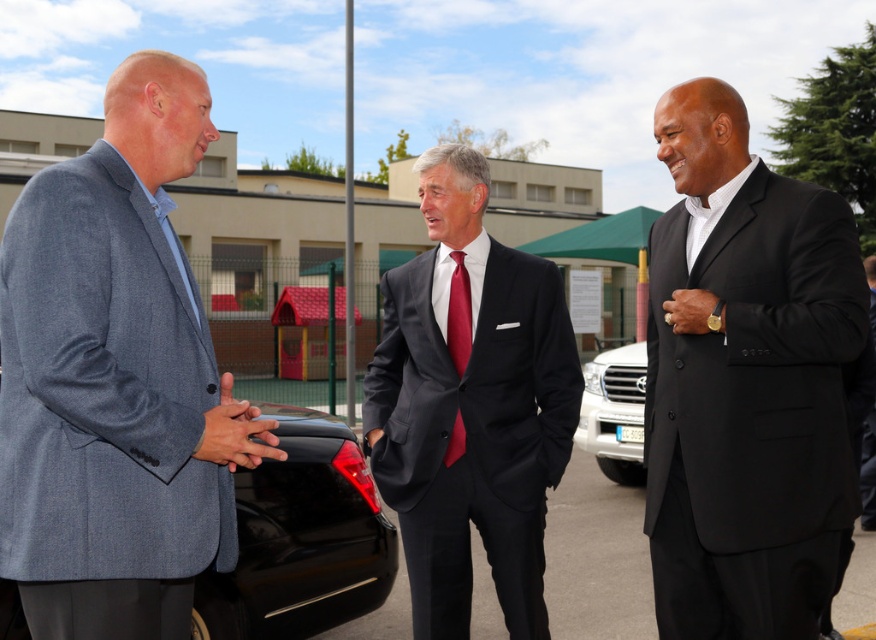
You are a photographer setting up a photo shoot. You need to ensure that the matte black suit at center and the shiny silk tie at center are both visible in the frame. Given their sizes, which object requires more space horizontally to be fully captured?

The matte black suit at center requires more space horizontally because its width is larger than the shiny silk tie at center.

You are standing in the scene and want to hand a document to the black smooth suit at right. Considering the social distance guideline of 1.8 meters, can you approach them without violating the guideline?

The distance between you and the black smooth suit at right is 3.11 meters, which is greater than the 1.8 meters social distancing guideline. You can approach closer to hand the document while maintaining the required distance.

Based on the scene description, can you determine which object is closer to the viewer between the matte black suit at center and the shiny black car at lower left?

The matte black suit at center is closer to the viewer than the shiny black car at lower left because it is positioned in front of it.